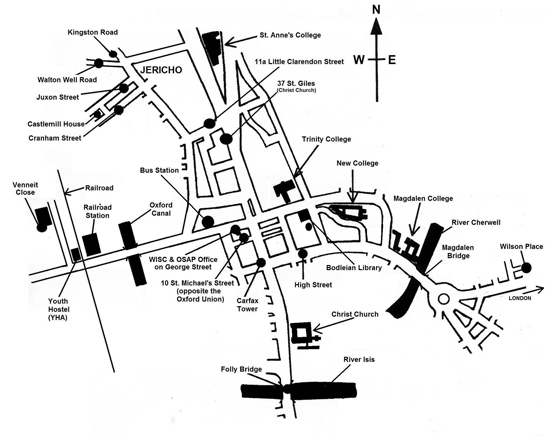
Identify the location of map. (185, 343).